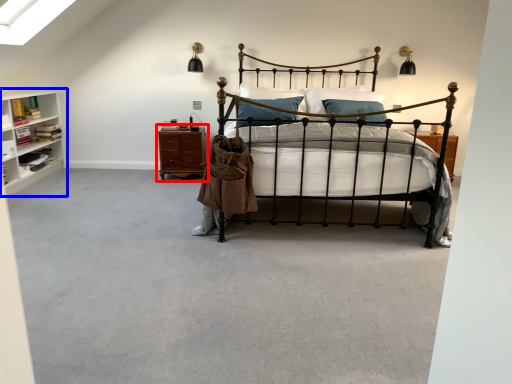
Question: Which of the following is the closest to the observer, nightstand (highlighted by a red box) or shelf (highlighted by a blue box)?

Choices:
 (A) nightstand
 (B) shelf

Answer: (B)